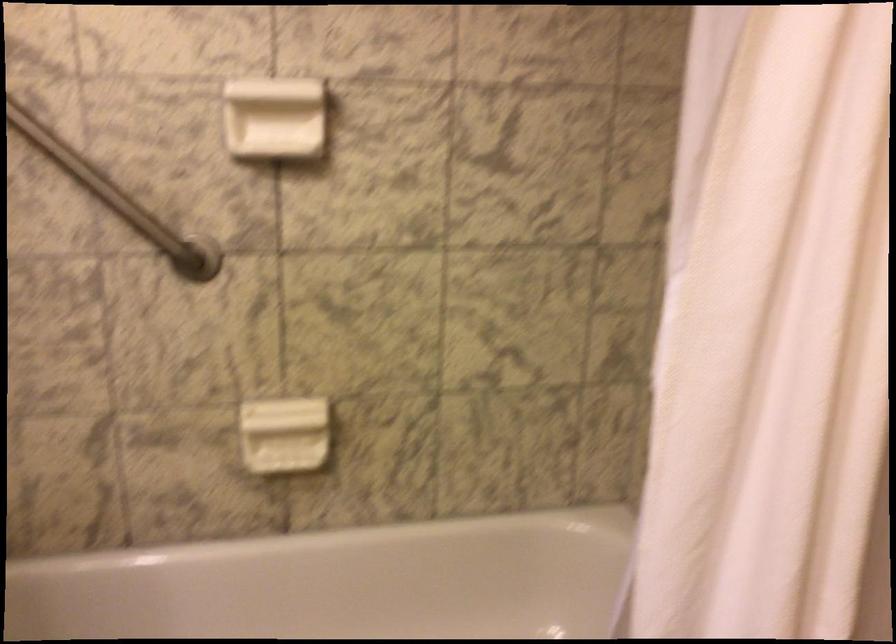
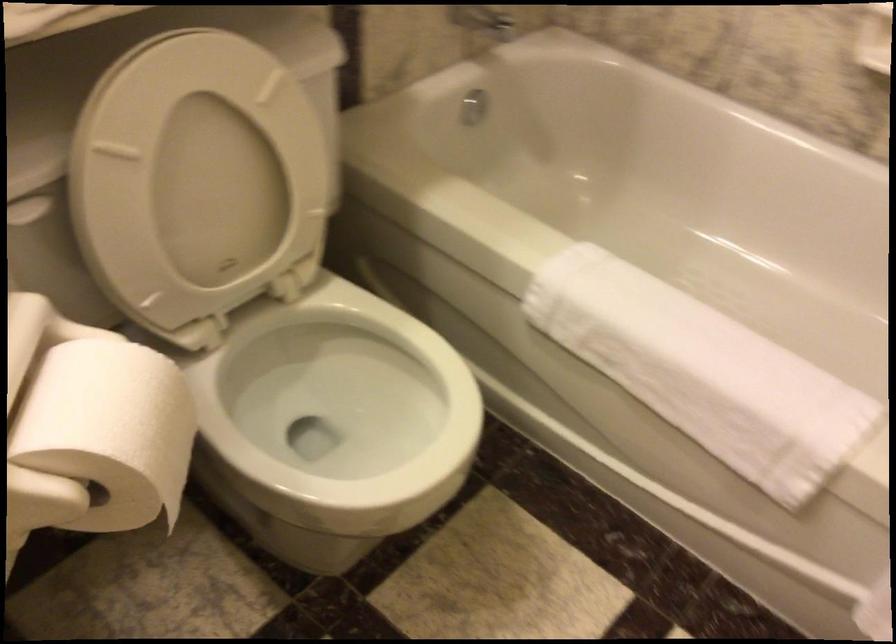
How did the camera likely rotate?

The camera rotated toward left-down.